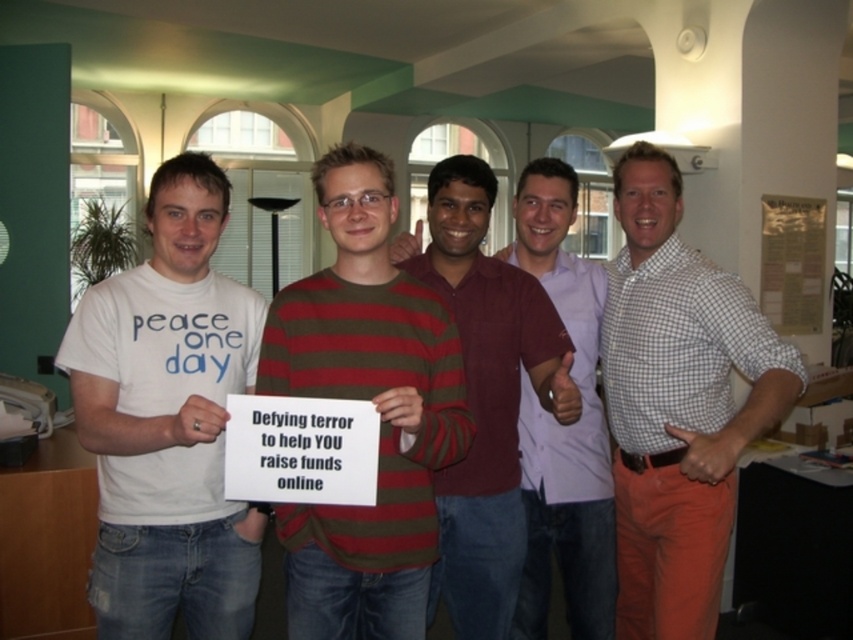
You are standing in the office and need to determine which of the two people at the center has a shorter top. The two people are wearing a maroon striped sweater at center and a light pink shirt at center. Which one has a shorter top?

The maroon striped sweater at center is shorter than the light pink shirt at center, so the person wearing the maroon striped sweater at center has a shorter top.